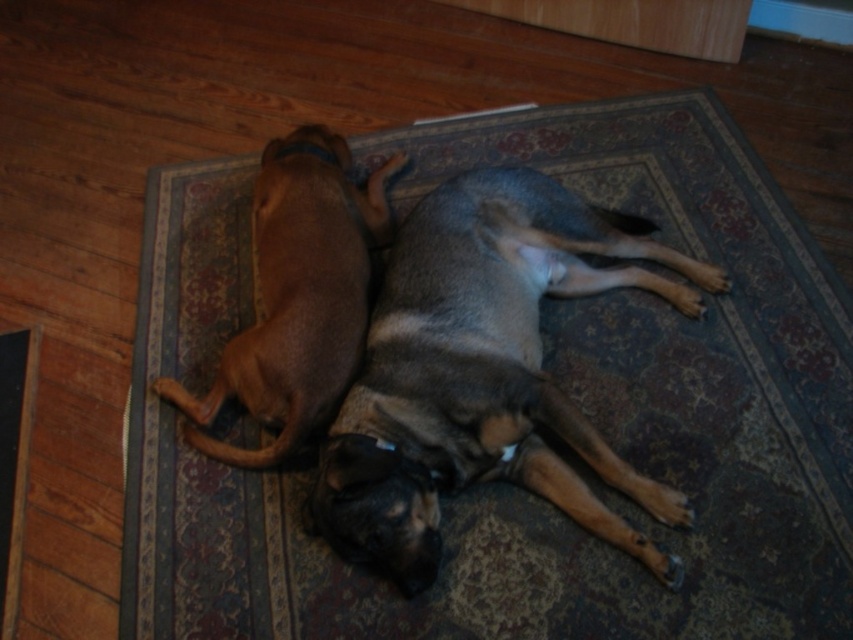
Question: Which point is closer to the camera?

Choices:
 (A) carpeted rug at center
 (B) brown matte dog at upper left

Answer: (A)

Question: Is carpeted rug at center to the left of gray fur dog at center from the viewer's perspective?

Choices:
 (A) no
 (B) yes

Answer: (B)

Question: Is carpeted rug at center to the left of gray fur dog at center from the viewer's perspective?

Choices:
 (A) no
 (B) yes

Answer: (B)

Question: Which point is closer to the camera taking this photo?

Choices:
 (A) (257, 340)
 (B) (389, 481)

Answer: (B)

Question: Does carpeted rug at center have a larger size compared to brown matte dog at upper left?

Choices:
 (A) yes
 (B) no

Answer: (A)

Question: Among these objects, which one is farthest from the camera?

Choices:
 (A) carpeted rug at center
 (B) brown matte dog at upper left
 (C) gray fur dog at center

Answer: (B)